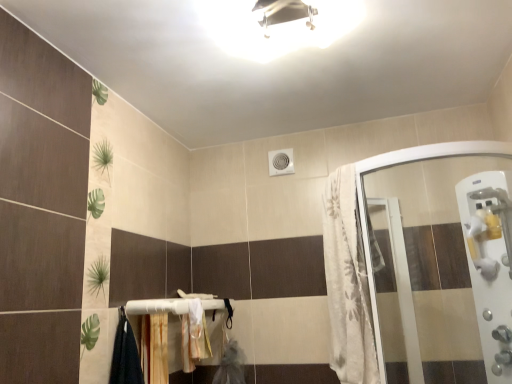
What is the approximate width of white fabric bath towel at lower center?

white fabric bath towel at lower center is 4.56 inches wide.

Describe the element at coordinates (277, 25) in the screenshot. I see `white glossy light fixture at upper center` at that location.

The image size is (512, 384). Identify the location of wooden at lower center. (154, 348).

Locate an element on the screen. white fabric bath towel at lower center is located at coordinates (194, 336).

Does white plastic handle at right turn towards white fabric bath towel at lower center?

No.

How different are the orientations of white plastic handle at right and white fabric bath towel at lower center in degrees?

95.4 degrees separate the facing orientations of white plastic handle at right and white fabric bath towel at lower center.

Is white plastic handle at right not close to white fabric bath towel at lower center?

Yes, white plastic handle at right and white fabric bath towel at lower center are located far from each other.

Locate an element on the screen. This screenshot has height=384, width=512. screen door in front of the white fabric bath towel at lower center is located at coordinates (490, 264).

Which of these two, white fabric bath towel at lower center or wooden at lower center, is bigger?

With larger size is wooden at lower center.

From the image's perspective, does white fabric bath towel at lower center appear lower than wooden at lower center?

Yes, from the image's perspective, white fabric bath towel at lower center is below wooden at lower center.

Is point (191, 318) closer or farther from the camera than point (165, 374)?

Clearly, point (191, 318) is more distant from the camera than point (165, 374).

Who is taller, white fabric bath towel at lower center or wooden at lower center?

wooden at lower center is taller.

From the image's perspective, is white textured fabric at right located above white plastic handle at right?

Yes, from the image's perspective, white textured fabric at right is on top of white plastic handle at right.

In terms of size, does white textured fabric at right appear bigger or smaller than white plastic handle at right?

Considering their sizes, white textured fabric at right takes up more space than white plastic handle at right.

Consider the image. Which is more to the right, white textured fabric at right or white plastic handle at right?

white plastic handle at right.

Is white textured fabric at right oriented towards white glossy light fixture at upper center?

No.

Which is in front, white textured fabric at right or white glossy light fixture at upper center?

white glossy light fixture at upper center is closer to the camera.

From the image's perspective, who appears lower, white textured fabric at right or white glossy light fixture at upper center?

white textured fabric at right, from the image's perspective.

Is white glossy light fixture at upper center bigger than white textured fabric at right?

Incorrect, white glossy light fixture at upper center is not larger than white textured fabric at right.

From the image's perspective, is white glossy light fixture at upper center on white textured fabric at right?

Yes, from the image's perspective, white glossy light fixture at upper center is above white textured fabric at right.

Is white glossy light fixture at upper center at the left side of white textured fabric at right?

Yes.

Is wooden at lower center positioned with its back to white plastic handle at right?

No, wooden at lower center's orientation is not away from white plastic handle at right.

Does wooden at lower center have a lesser height compared to white plastic handle at right?

Indeed, wooden at lower center has a lesser height compared to white plastic handle at right.

Considering the positions of point (149, 380) and point (504, 223), is point (149, 380) closer or farther from the camera than point (504, 223)?

Point (149, 380) is closer to the camera than point (504, 223).

Considering the sizes of objects wooden at lower center and white plastic handle at right in the image provided, who is wider, wooden at lower center or white plastic handle at right?

white plastic handle at right is wider.

Do you think wooden at lower center is within white fabric bath towel at lower center, or outside of it?

The correct answer is: outside.

From a real-world perspective, is wooden at lower center physically below white fabric bath towel at lower center?

Yes, from a real-world perspective, wooden at lower center is below white fabric bath towel at lower center.

Who is more distant, wooden at lower center or white fabric bath towel at lower center?

white fabric bath towel at lower center is further from the camera.

From the image's perspective, is wooden at lower center located above or below white fabric bath towel at lower center?

Clearly, from the image's perspective, wooden at lower center is above white fabric bath towel at lower center.

Find the location of a particular element. bath towel below the white plastic handle at right (from a real-world perspective) is located at coordinates (194, 336).

Locate an element on the screen. Image resolution: width=512 pixels, height=384 pixels. bath towel to the right of wooden at lower center is located at coordinates (194, 336).

Which object lies nearer to the anchor point wooden at lower center, white glossy light fixture at upper center or white textured fabric at right?

white textured fabric at right lies closer to wooden at lower center than the other object.

Looking at the image, which one is located further to white textured fabric at right, white fabric bath towel at lower center or white glossy light fixture at upper center?

The object further to white textured fabric at right is white fabric bath towel at lower center.

Based on their spatial positions, is white plastic handle at right or wooden at lower center closer to white glossy light fixture at upper center?

Among the two, white plastic handle at right is located nearer to white glossy light fixture at upper center.

Looking at the image, which one is located further to white glossy light fixture at upper center, wooden at lower center or white fabric bath towel at lower center?

wooden at lower center is further to white glossy light fixture at upper center.

Based on their spatial positions, is white glossy light fixture at upper center or white fabric bath towel at lower center closer to white textured fabric at right?

white glossy light fixture at upper center is positioned closer to the anchor white textured fabric at right.

From the image, which object appears to be nearer to white plastic handle at right, wooden at lower center or white textured fabric at right?

The object closer to white plastic handle at right is white textured fabric at right.

When comparing their distances from white glossy light fixture at upper center, does white plastic handle at right or white fabric bath towel at lower center seem closer?

white plastic handle at right lies closer to white glossy light fixture at upper center than the other object.

Looking at the image, which one is located closer to wooden at lower center, white textured fabric at right or white fabric bath towel at lower center?

Based on the image, white fabric bath towel at lower center appears to be nearer to wooden at lower center.

You are a GUI agent. You are given a task and a screenshot of the screen. Output one action in this format:
    pyautogui.click(x=<x>, y=<y>)
    Task: Click on the shower curtain between white fabric bath towel at lower center and white plastic handle at right
    
    Given the screenshot: What is the action you would take?
    pyautogui.click(x=347, y=283)

Image resolution: width=512 pixels, height=384 pixels. Identify the location of bath towel between wooden at lower center and white textured fabric at right. (194, 336).

Where is `shower curtain between white glossy light fixture at upper center and white fabric bath towel at lower center vertically`? This screenshot has height=384, width=512. shower curtain between white glossy light fixture at upper center and white fabric bath towel at lower center vertically is located at coordinates (347, 283).

You are a GUI agent. You are given a task and a screenshot of the screen. Output one action in this format:
    pyautogui.click(x=<x>, y=<y>)
    Task: Click on the bath towel between wooden at lower center and white plastic handle at right
    The height and width of the screenshot is (384, 512).
    Given the screenshot: What is the action you would take?
    pyautogui.click(x=194, y=336)